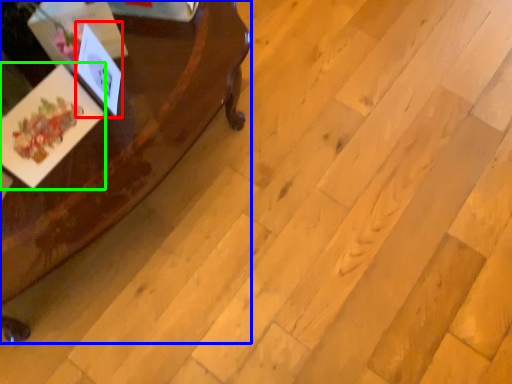
Question: Which is nearer to the postcard (highlighted by a red box)? table (highlighted by a blue box) or postcard (highlighted by a green box).

Choices:
 (A) table
 (B) postcard

Answer: (B)